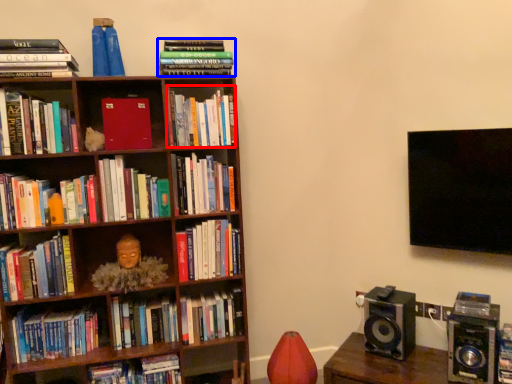
Question: Which of the following is the closest to the observer, book (highlighted by a red box) or book (highlighted by a blue box)?

Choices:
 (A) book
 (B) book

Answer: (B)